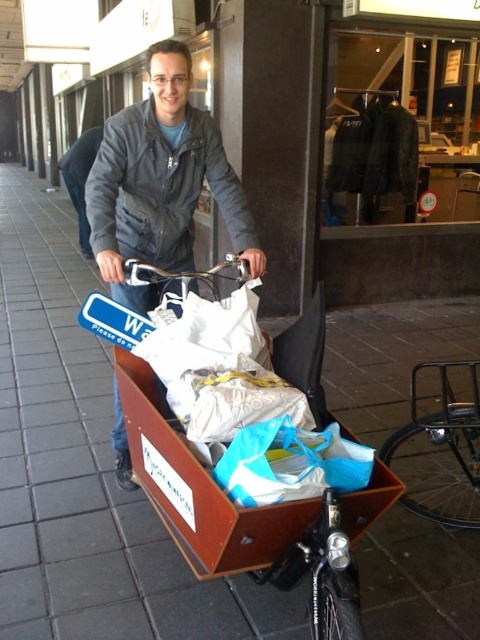
You are a delivery person standing at the edge of the brown tile pavement at center. You need to place a package that is 1.8 meters long on the pavement. Is there enough space for the package?

The brown tile pavement at center is 1.78 meters from viewer, so the package that is 1.8 meters long may not fit as it is slightly longer than the available space.

You are standing at the point marked as point [85,467]. Looking around, you see brown tile pavement at center. Which direction should you walk to reach the brown tile pavement at center?

You are already at the point marked as point [85,467], which is on the brown tile pavement at center, so you don not need to walk anywhere else.